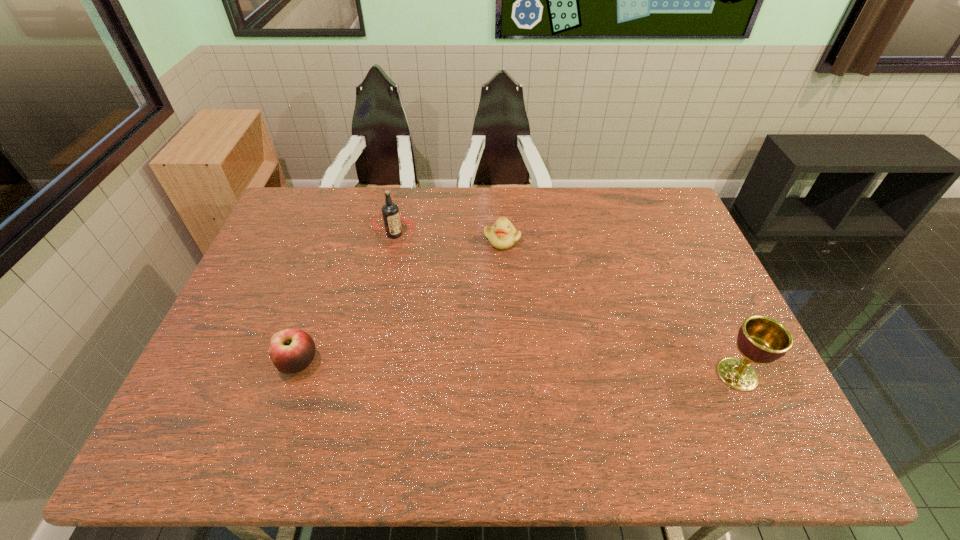
The image size is (960, 540). In the image, there is a desktop. What are the coordinates of `free space at the far edge` in the screenshot? It's located at (425, 191).

Locate an element on the screen. The image size is (960, 540). free space at the near edge of the desktop is located at coordinates (282, 401).

In the image, there is a desktop. Where is `vacant space at the left edge`? vacant space at the left edge is located at coordinates (283, 256).

Find the location of a particular element. This screenshot has width=960, height=540. vacant space at the right edge of the desktop is located at coordinates (694, 374).

Where is `vacant space at the far left corner`? The height and width of the screenshot is (540, 960). vacant space at the far left corner is located at coordinates (329, 192).

This screenshot has width=960, height=540. Identify the location of vacant space at the near left corner of the desktop. (245, 409).

You are a GUI agent. You are given a task and a screenshot of the screen. Output one action in this format:
    pyautogui.click(x=<x>, y=<y>)
    Task: Click on the vacant space at the far right corner
    This screenshot has width=960, height=540.
    Given the screenshot: What is the action you would take?
    pyautogui.click(x=651, y=194)

Locate an element on the screen. Image resolution: width=960 pixels, height=540 pixels. free space at the near right corner of the desktop is located at coordinates (725, 386).

Image resolution: width=960 pixels, height=540 pixels. Find the location of `blank region between the third object from left to right and the second object from left to right`. blank region between the third object from left to right and the second object from left to right is located at coordinates point(448,237).

Identify the location of vacant point located between the apple and the root beer. The width and height of the screenshot is (960, 540). (347, 299).